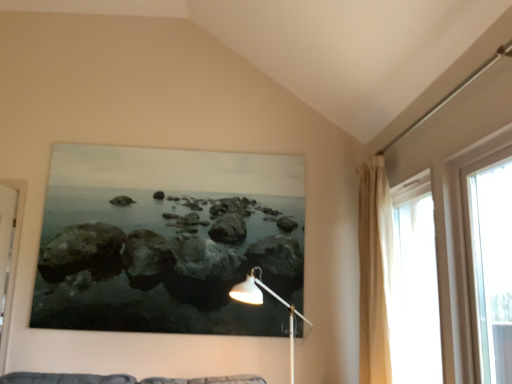
Question: Does transparent glass window at right, which is the first window in front-to-back order, have a greater width compared to translucent fabric curtain at right, the first window in the back-to-front sequence?

Choices:
 (A) no
 (B) yes

Answer: (A)

Question: From the image's perspective, is transparent glass window at right, which is the first window in front-to-back order, on top of translucent fabric curtain at right, the 2th window when ordered from front to back?

Choices:
 (A) no
 (B) yes

Answer: (B)

Question: Does transparent glass window at right, which is the first window in front-to-back order, have a larger size compared to translucent fabric curtain at right, the first window in the back-to-front sequence?

Choices:
 (A) no
 (B) yes

Answer: (A)

Question: From a real-world perspective, is transparent glass window at right, acting as the second window starting from the back, positioned over translucent fabric curtain at right, the 2th window when ordered from front to back, based on gravity?

Choices:
 (A) no
 (B) yes

Answer: (B)

Question: From the image's perspective, is transparent glass window at right, which is the first window in front-to-back order, located beneath translucent fabric curtain at right, the 2th window when ordered from front to back?

Choices:
 (A) yes
 (B) no

Answer: (B)

Question: Considering the relative sizes of transparent glass window at right, acting as the second window starting from the back, and translucent fabric curtain at right, the 2th window when ordered from front to back, in the image provided, is transparent glass window at right, acting as the second window starting from the back, smaller than translucent fabric curtain at right, the 2th window when ordered from front to back,?

Choices:
 (A) no
 (B) yes

Answer: (B)

Question: Considering the relative positions of translucent fabric curtain at right, the 2th window when ordered from front to back, and beige fabric curtain at right in the image provided, is translucent fabric curtain at right, the 2th window when ordered from front to back, behind beige fabric curtain at right?

Choices:
 (A) no
 (B) yes

Answer: (A)

Question: From a real-world perspective, does translucent fabric curtain at right, the first window in the back-to-front sequence, sit lower than beige fabric curtain at right?

Choices:
 (A) no
 (B) yes

Answer: (B)

Question: Is translucent fabric curtain at right, the 2th window when ordered from front to back, directly adjacent to beige fabric curtain at right?

Choices:
 (A) no
 (B) yes

Answer: (A)

Question: From a real-world perspective, is translucent fabric curtain at right, the first window in the back-to-front sequence, positioned over beige fabric curtain at right based on gravity?

Choices:
 (A) yes
 (B) no

Answer: (B)

Question: Is translucent fabric curtain at right, the first window in the back-to-front sequence, outside beige fabric curtain at right?

Choices:
 (A) yes
 (B) no

Answer: (A)

Question: From the image's perspective, is translucent fabric curtain at right, the first window in the back-to-front sequence, below beige fabric curtain at right?

Choices:
 (A) no
 (B) yes

Answer: (B)

Question: Is white metal floor lamp at lower center wider than transparent glass window at right, which is the first window in front-to-back order?

Choices:
 (A) no
 (B) yes

Answer: (B)